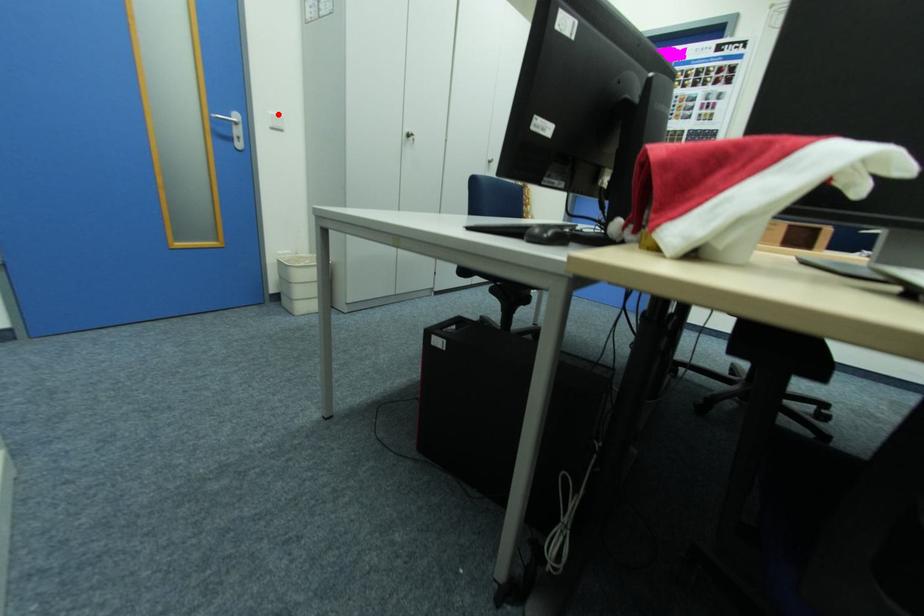
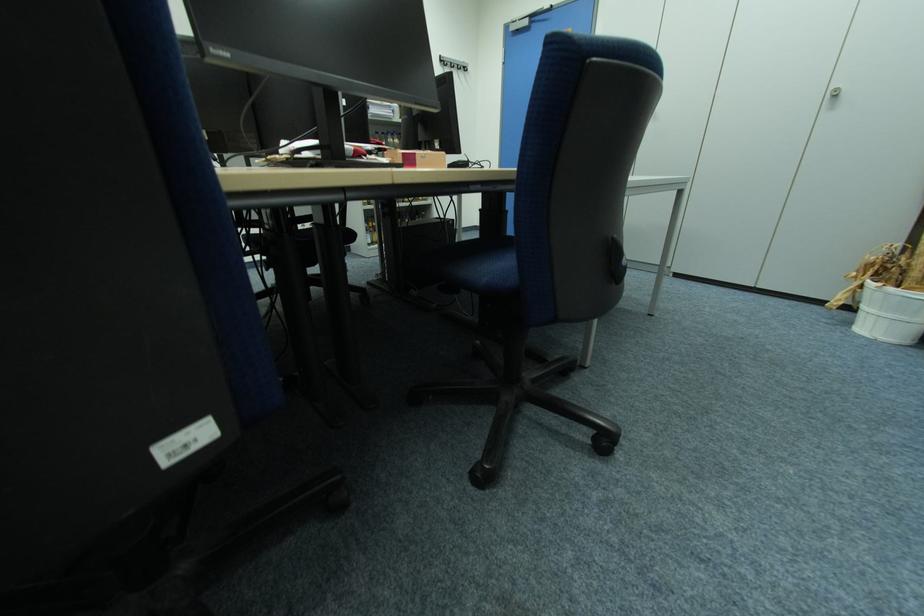
Question: I am providing you with two images of the same scene from different viewpoints. A red point is marked on the first image. At the location where the point appears in image 1, is it still visible in image 2?

Choices:
 (A) Yes
 (B) No

Answer: (B)